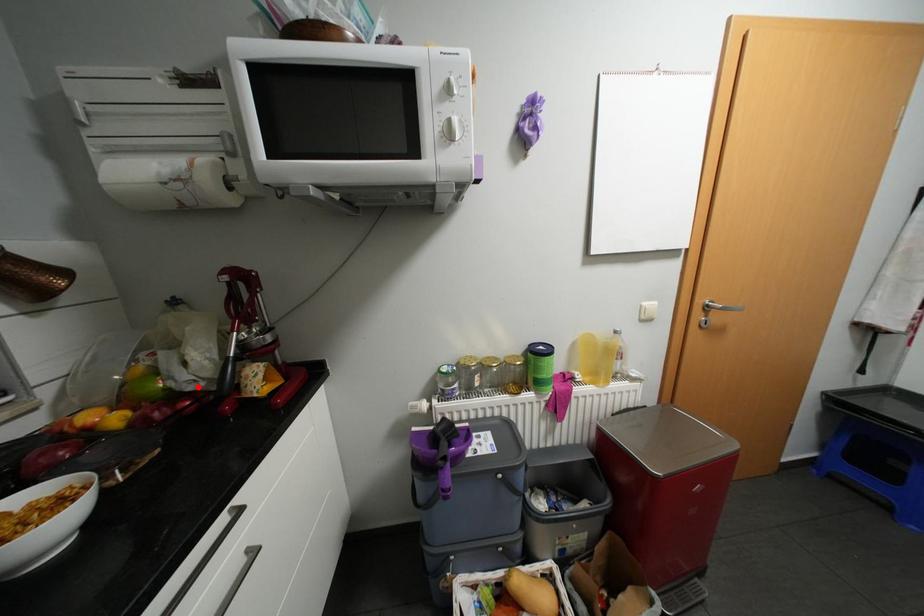
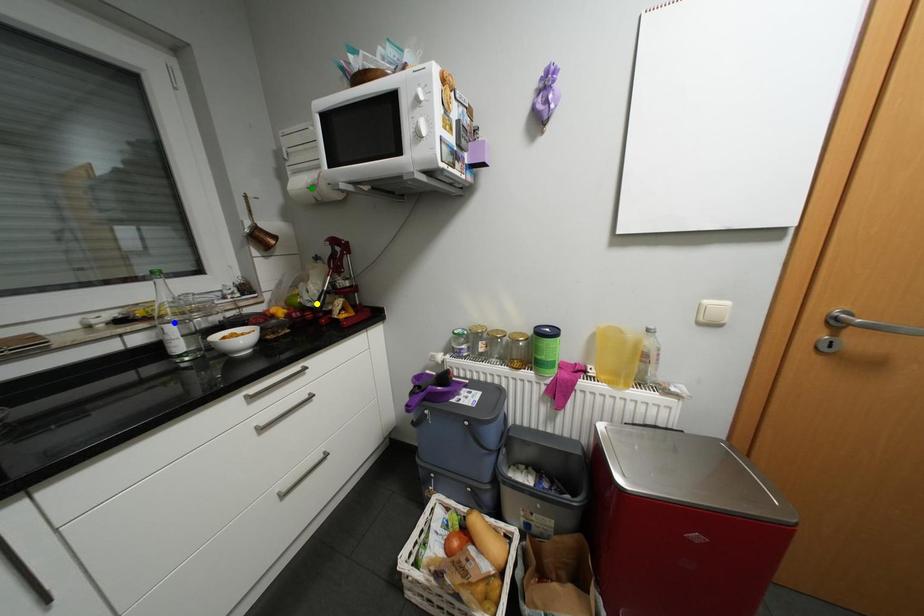
Question: I am providing you with two images of the same scene from different viewpoints. A red point is marked on the first image. You are given multiple points on the second image. In image 2, which mark is for the same physical point as the one in image 1?

Choices:
 (A) yellow point
 (B) blue point
 (C) green point

Answer: (A)